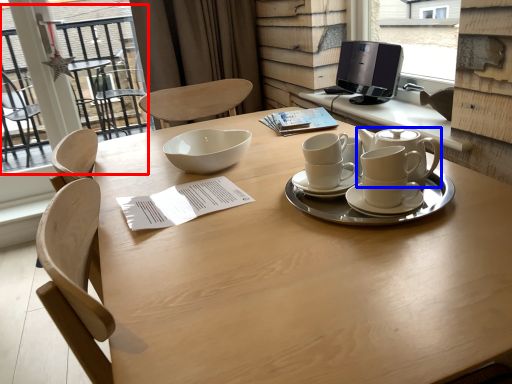
Question: Among these objects, which one is nearest to the camera, glass door (highlighted by a red box) or teapot (highlighted by a blue box)?

Choices:
 (A) glass door
 (B) teapot

Answer: (B)